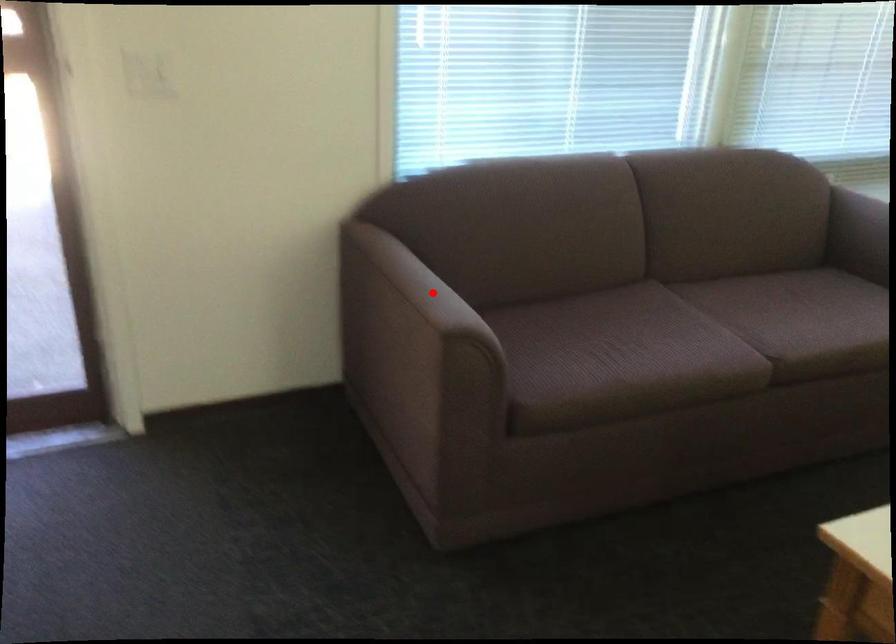
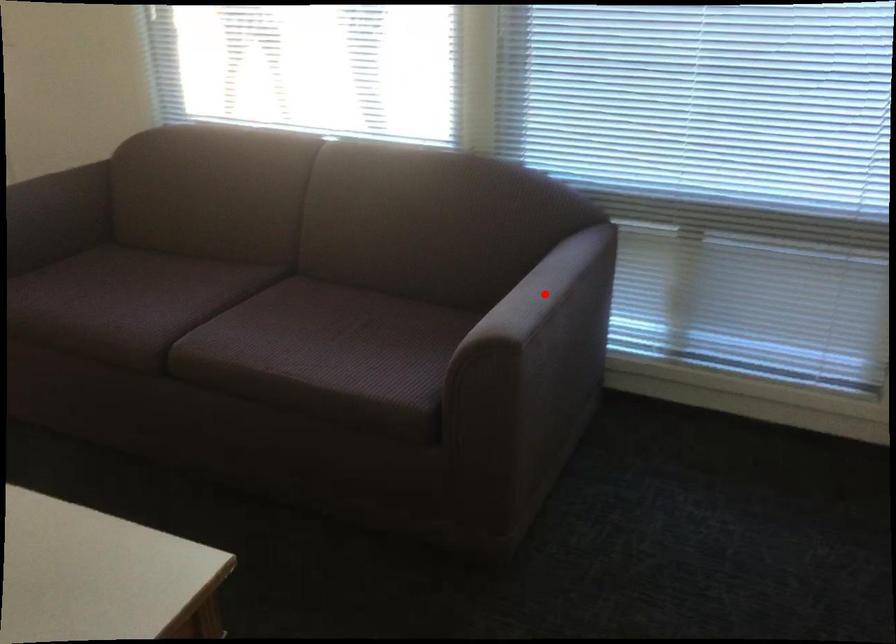
I am providing you with two images of the same scene from different viewpoints. A red point is marked on the first image and another point is marked on the second image. Does the point marked in image1 correspond to the same location as the one in image2?

No